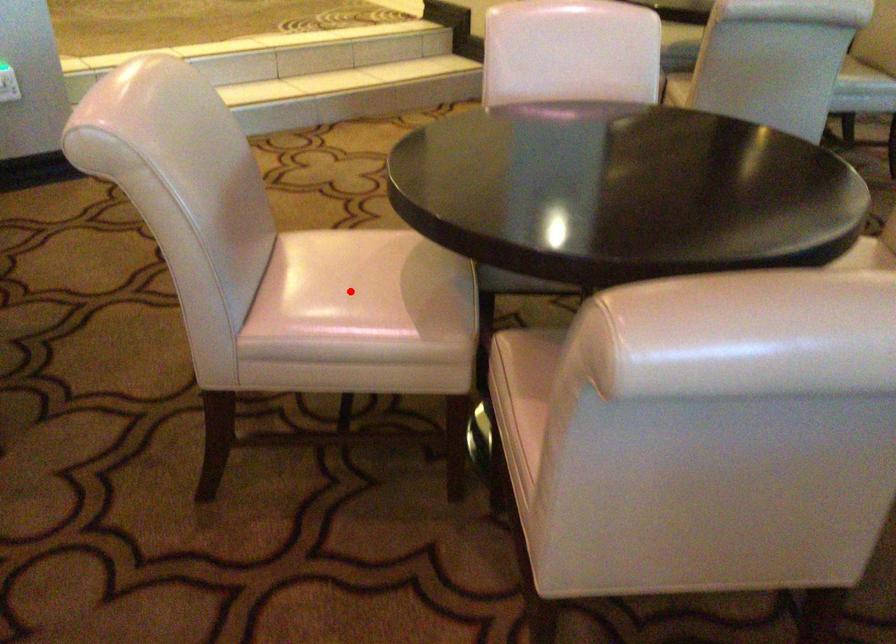
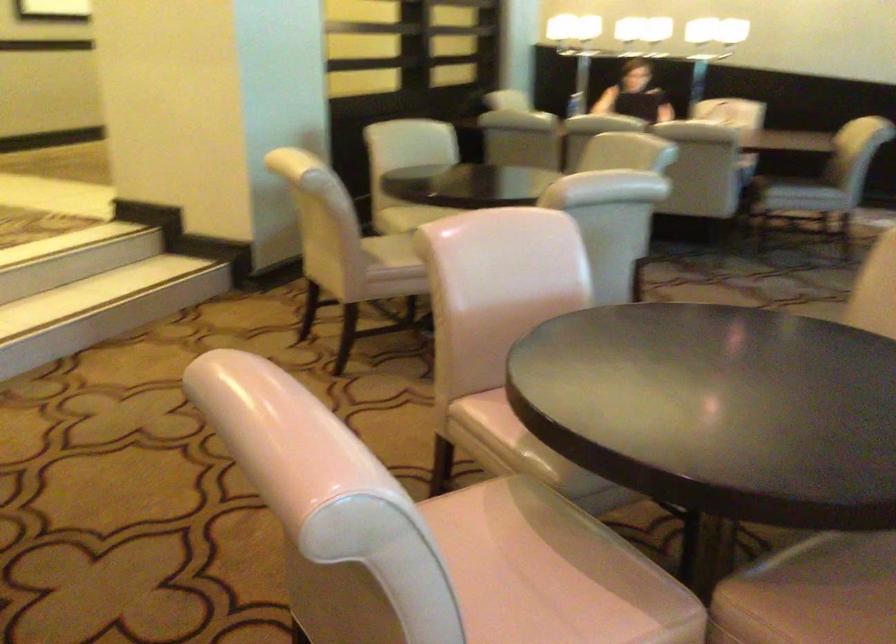
Where in the second image is the point corresponding to the highlighted location from the first image?

(520, 587)